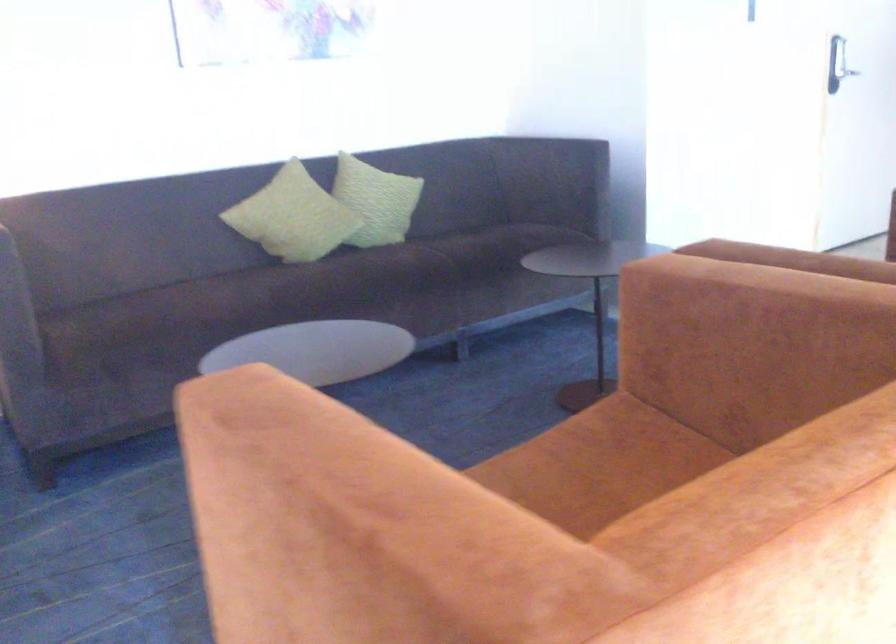
What do you see at coordinates (839, 58) in the screenshot? The image size is (896, 644). I see `a door handle` at bounding box center [839, 58].